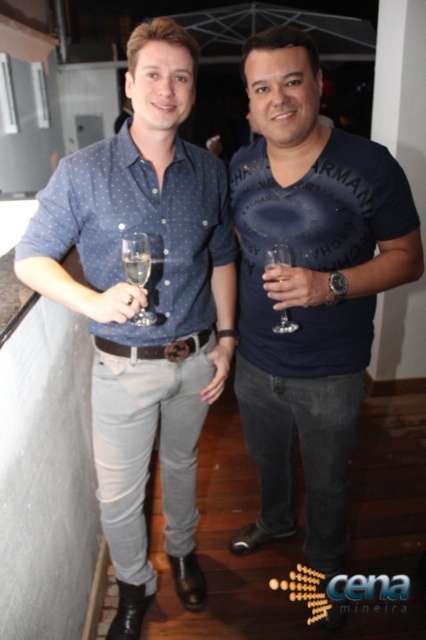
Question: Considering the real-world distances, which object is closest to the matte blue shirt at left?

Choices:
 (A) clear glass wine glass at left
 (B) clear glass at center

Answer: (A)

Question: Is matte blue shirt at left further to camera compared to dark blue cotton t-shirt at center?

Choices:
 (A) yes
 (B) no

Answer: (B)

Question: Based on their relative distances, which object is farther from the matte blue shirt at left?

Choices:
 (A) clear glass wine glass at center
 (B) dark blue cotton t-shirt at center
 (C) clear glass at center
 (D) clear glass wine glass at left

Answer: (A)

Question: Does matte blue shirt at left have a lesser width compared to clear glass wine glass at center?

Choices:
 (A) yes
 (B) no

Answer: (B)

Question: Which object is positioned closest to the clear glass at center?

Choices:
 (A) clear glass wine glass at center
 (B) clear glass wine glass at left
 (C) dark blue cotton t-shirt at center
 (D) matte blue shirt at left

Answer: (B)

Question: Observing the image, what is the correct spatial positioning of clear glass at center in reference to clear glass wine glass at center?

Choices:
 (A) above
 (B) below

Answer: (A)